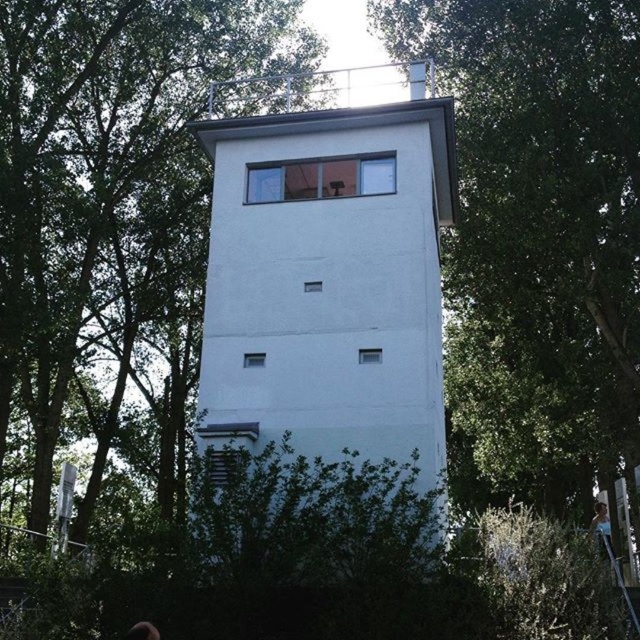
Between point (298, 544) and point (593, 509), which one is positioned behind?

The point (593, 509) is behind.

Does white smooth tower at center have a lesser width compared to light blue shirt at center?

In fact, white smooth tower at center might be wider than light blue shirt at center.

Measure the distance between white smooth tower at center and camera.

white smooth tower at center is 8.89 meters from camera.

You are a GUI agent. You are given a task and a screenshot of the screen. Output one action in this format:
    pyautogui.click(x=<x>, y=<y>)
    Task: Click on the white smooth tower at center
    This screenshot has height=640, width=640.
    Given the screenshot: What is the action you would take?
    [x=326, y=324]

Is green leafy tree at center further to camera compared to metallic silver ladder at lower right?

Yes, green leafy tree at center is behind metallic silver ladder at lower right.

Is green leafy tree at center bigger than metallic silver ladder at lower right?

Yes.

Locate an element on the screen. The image size is (640, 640). green leafy tree at center is located at coordinates (108, 209).

Does green leafy tree at center have a smaller size compared to light blue shirt at center?

No, green leafy tree at center is not smaller than light blue shirt at center.

Consider the image. Does green leafy tree at center lie in front of light blue shirt at center?

No, green leafy tree at center is behind light blue shirt at center.

I want to click on green leafy tree at center, so click(108, 209).

You are a GUI agent. You are given a task and a screenshot of the screen. Output one action in this format:
    pyautogui.click(x=<x>, y=<y>)
    Task: Click on the green leafy tree at center
    This screenshot has height=640, width=640.
    Given the screenshot: What is the action you would take?
    pyautogui.click(x=108, y=209)